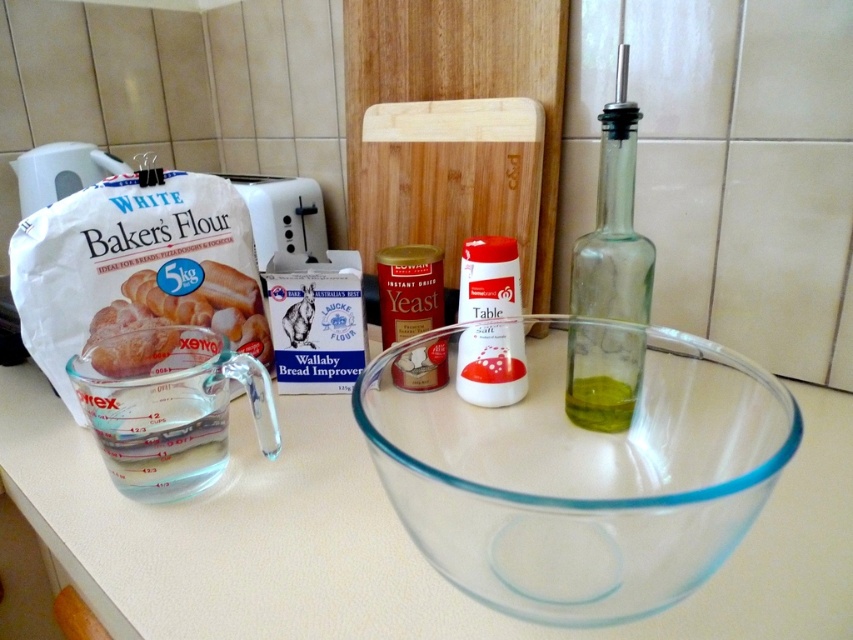
Question: Considering the relative positions of green glass bottle at right and white matte bakers flour at left in the image provided, where is green glass bottle at right located with respect to white matte bakers flour at left?

Choices:
 (A) below
 (B) above

Answer: (B)

Question: From the image, what is the correct spatial relationship of transparent glass bowl at center in relation to green glass bottle at right?

Choices:
 (A) below
 (B) above

Answer: (A)

Question: Which object is farther from the camera taking this photo?

Choices:
 (A) white matte bakers flour at left
 (B) transparent glass bowl at center

Answer: (A)

Question: Can you confirm if transparent glass bowl at center is positioned to the right of green glass bottle at right?

Choices:
 (A) no
 (B) yes

Answer: (A)

Question: Which object is farther from the camera taking this photo?

Choices:
 (A) transparent glass bowl at center
 (B) green glass bottle at right

Answer: (B)

Question: Which object is positioned closest to the green glass bottle at right?

Choices:
 (A) transparent glass bowl at center
 (B) white matte bakers flour at left

Answer: (A)